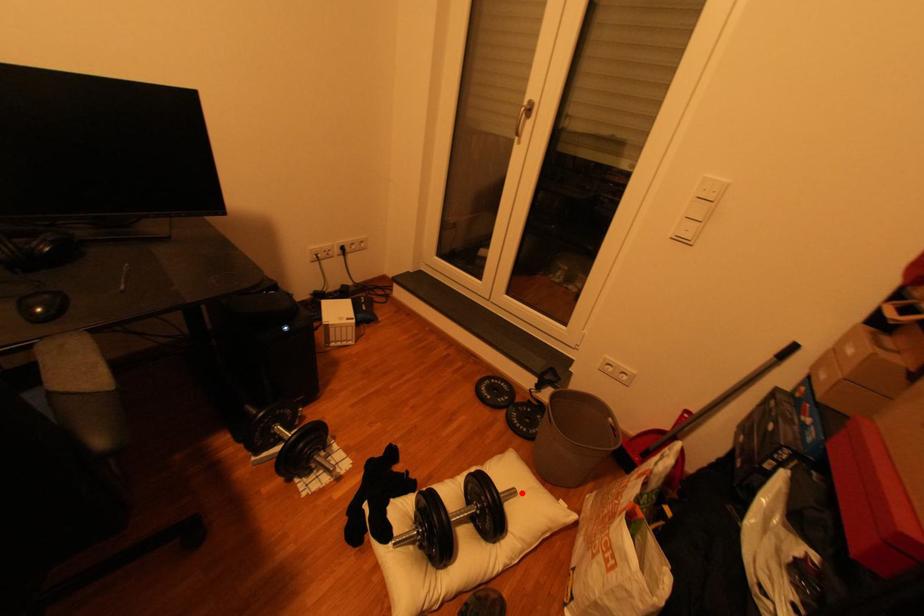
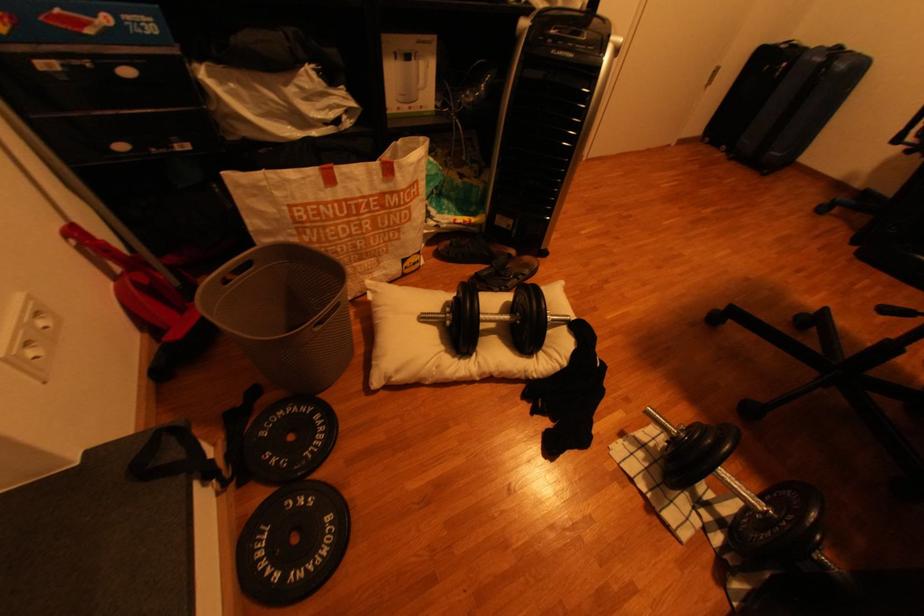
The point at the highlighted location is marked in the first image. Where is the corresponding point in the second image?

(433, 318)